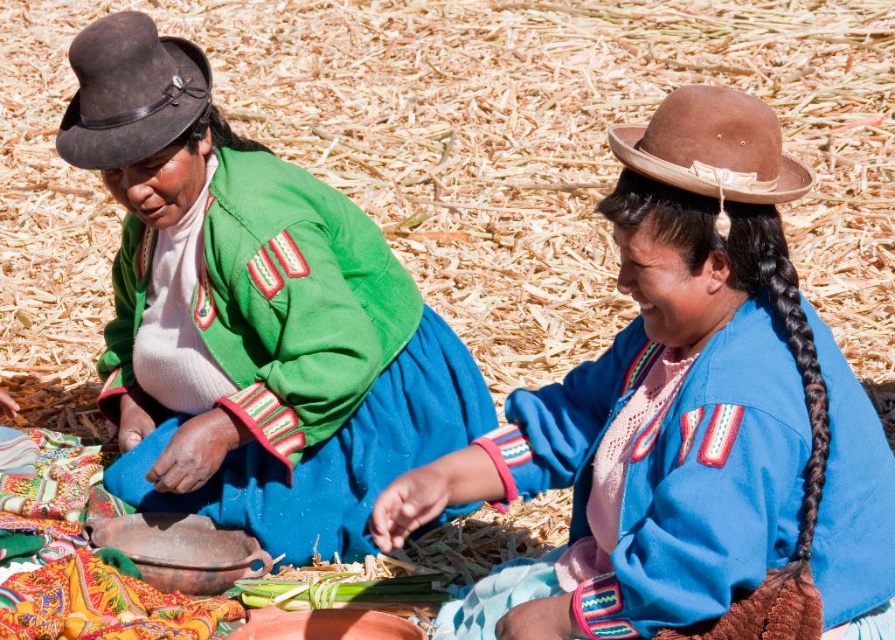
Who is more distant from viewer, (859,276) or (701,451)?

Point (859,276)

In order to click on brown straw at center in this screenshot , I will do `click(462, 160)`.

Based on the photo, who is higher up, blue woven fabric at center or green woven fabric at left?

green woven fabric at left

Can you confirm if blue woven fabric at center is bigger than green woven fabric at left?

Actually, blue woven fabric at center might be smaller than green woven fabric at left.

Find the location of a particular element. This screenshot has width=895, height=640. blue woven fabric at center is located at coordinates (687, 424).

Can you confirm if green woven fabric at left is positioned to the left of black silky hair at right?

Correct, you'll find green woven fabric at left to the left of black silky hair at right.

Between point (166, 400) and point (808, 364), which one is positioned behind?

Point (166, 400)

You are a GUI agent. You are given a task and a screenshot of the screen. Output one action in this format:
    pyautogui.click(x=<x>, y=<y>)
    Task: Click on the green woven fabric at left
    
    Given the screenshot: What is the action you would take?
    click(x=270, y=352)